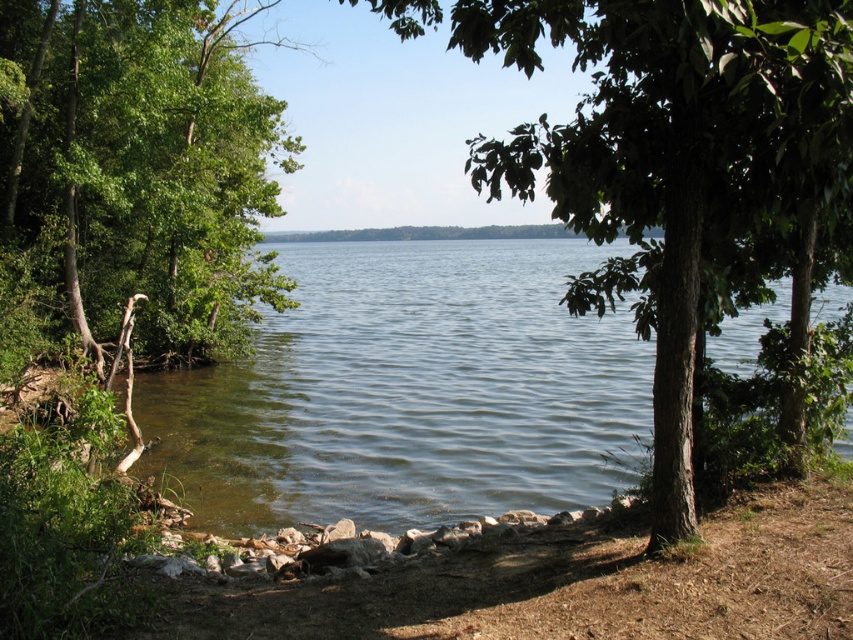
You are standing at the edge of the lake and want to place a small boat in the water. Since the boat requires a flat surface to launch, will the clear water at center and the smooth dirt shoreline at lower center provide a suitable area for launching the boat?

The clear water at center is taller than the smooth dirt shoreline at lower center, so the smooth dirt shoreline at lower center is lower and likely flat, making it suitable for launching the boat. The clear water at center may be too deep for a stable launch point.

Looking at this image, you are standing at the lakeside and notice two points marked in the scene. Which point is closer to you, point (170, 468) or point (70, 260)?

Point (170, 468) is in front of point (70, 260), so it is closer to you.